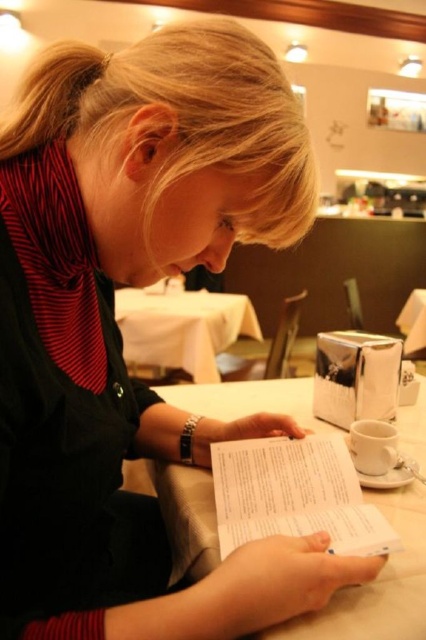
Does white paper book at center appear under white glossy table at center?

Yes.

Can you confirm if white paper book at center is thinner than white glossy table at center?

Yes, white paper book at center is thinner than white glossy table at center.

Which is in front, point (222, 486) or point (147, 352)?

Point (222, 486) is in front.

Locate an element on the screen. white paper book at center is located at coordinates (294, 493).

Can you confirm if white smooth table at center is positioned to the left of white paper book at center?

A: In fact, white smooth table at center is to the right of white paper book at center.

Can you confirm if white smooth table at center is shorter than white paper book at center?

No, white smooth table at center is not shorter than white paper book at center.

Which is behind, point (178, 477) or point (236, 516)?

Point (178, 477)

The image size is (426, 640). In order to click on white smooth table at center in this screenshot , I will do `click(377, 584)`.

Can you confirm if white smooth table at center is smaller than white glossy table at center?

Correct, white smooth table at center occupies less space than white glossy table at center.

Can you confirm if white smooth table at center is positioned above white glossy table at center?

Actually, white smooth table at center is below white glossy table at center.

The width and height of the screenshot is (426, 640). I want to click on white smooth table at center, so click(x=377, y=584).

Find the location of `white smooth table at center`. white smooth table at center is located at coordinates pyautogui.click(x=377, y=584).